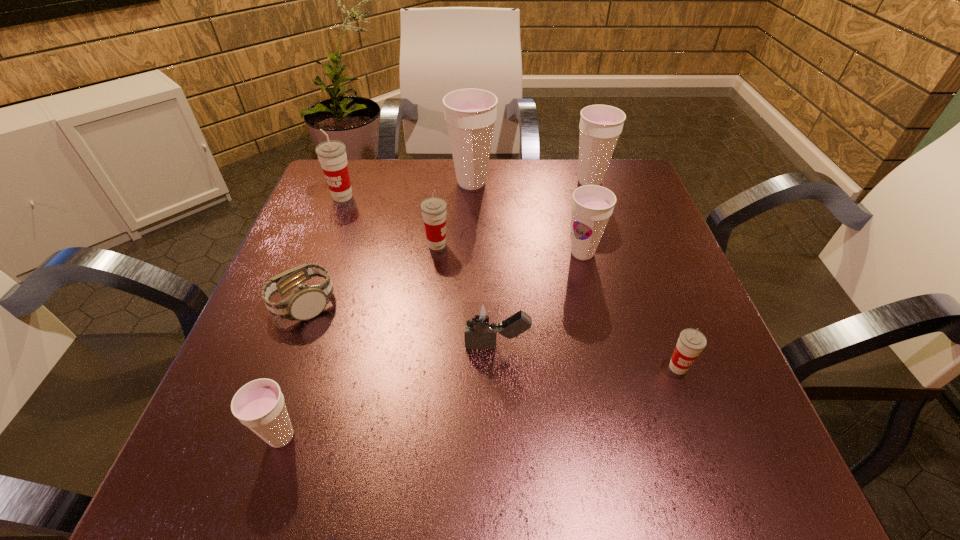
This screenshot has height=540, width=960. I want to click on vacant area at the near edge, so click(357, 482).

The height and width of the screenshot is (540, 960). Find the location of `blank area at the left edge`. blank area at the left edge is located at coordinates (250, 342).

Where is `free space at the right edge of the desktop`? This screenshot has width=960, height=540. free space at the right edge of the desktop is located at coordinates (704, 392).

Where is `vacant space at the far left corner of the desktop`? vacant space at the far left corner of the desktop is located at coordinates (367, 196).

This screenshot has width=960, height=540. Find the location of `free location at the near left corner of the desktop`. free location at the near left corner of the desktop is located at coordinates (294, 480).

I want to click on vacant space at the far right corner of the desktop, so click(617, 176).

The width and height of the screenshot is (960, 540). Find the location of `free space between the third smallest purple cup and the farthest red cup`. free space between the third smallest purple cup and the farthest red cup is located at coordinates (467, 189).

The height and width of the screenshot is (540, 960). Identify the location of free space between the second smallest purple cup and the gray igniter. (540, 300).

I want to click on vacant space in between the second biggest purple cup and the leftmost purple cup, so click(x=436, y=309).

Find the location of a particular element. vacant space in between the watch and the gray igniter is located at coordinates (400, 325).